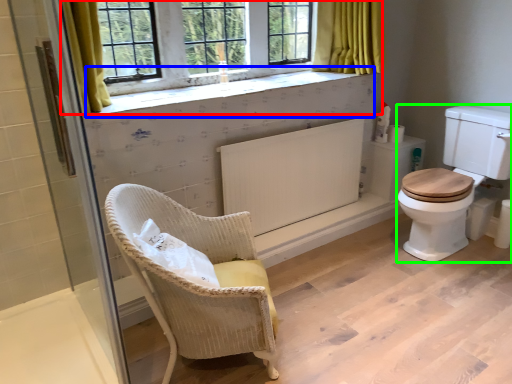
Question: Based on their relative distances, which object is nearer to window (highlighted by a red box)? Choose from window sill (highlighted by a blue box) and rocking chair (highlighted by a green box).

Choices:
 (A) window sill
 (B) rocking chair

Answer: (A)